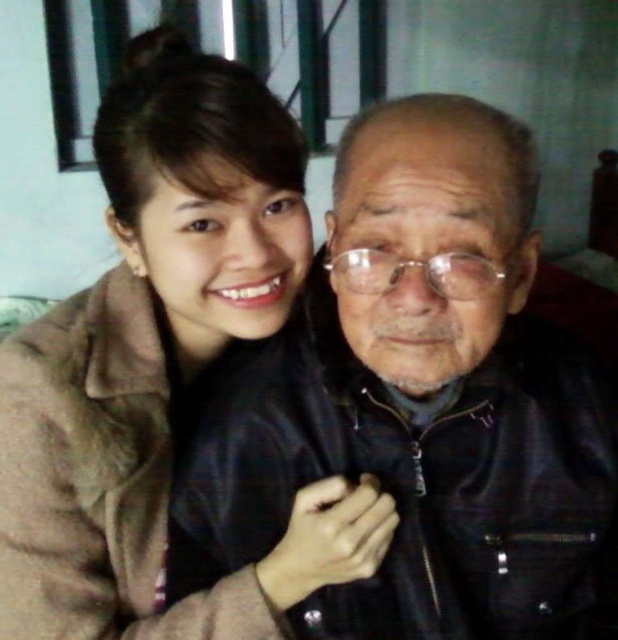
Can you confirm if leather jacket at center is taller than brown fuzzy coat at upper left?

No, leather jacket at center is not taller than brown fuzzy coat at upper left.

Image resolution: width=618 pixels, height=640 pixels. What do you see at coordinates (417, 401) in the screenshot? I see `leather jacket at center` at bounding box center [417, 401].

Locate an element on the screen. Image resolution: width=618 pixels, height=640 pixels. leather jacket at center is located at coordinates (417, 401).